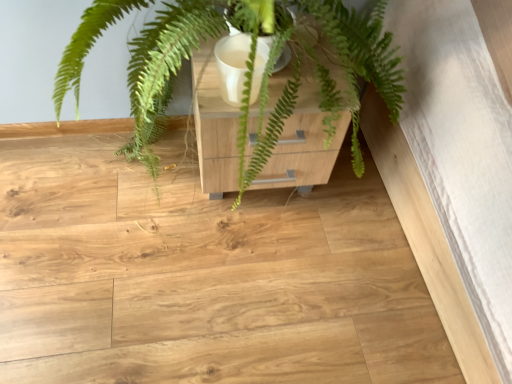
In order to click on free spot to the right of wooden dresser at center in this screenshot , I will do `click(361, 217)`.